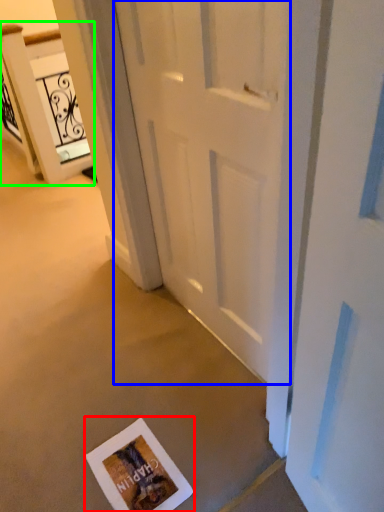
Question: Which object is the closest to the postcard (highlighted by a red box)? Choose among these: door (highlighted by a blue box) or elevator (highlighted by a green box).

Choices:
 (A) door
 (B) elevator

Answer: (A)